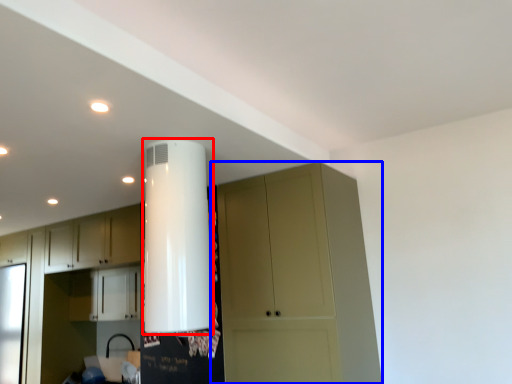
Question: Which object appears closest to the camera in this image, water heater (highlighted by a red box) or cupboard (highlighted by a blue box)?

Choices:
 (A) water heater
 (B) cupboard

Answer: (A)